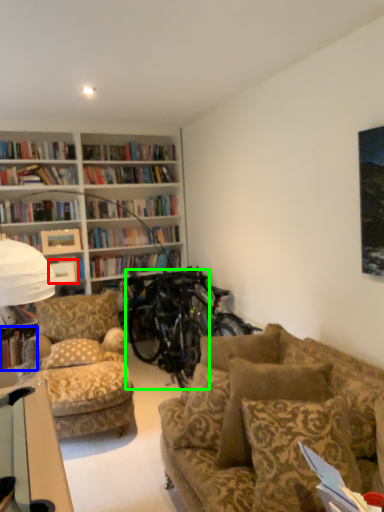
Question: Based on their relative distances, which object is nearer to picture frame (highlighted by a red box)? Choose from book (highlighted by a blue box) and bicycle (highlighted by a green box).

Choices:
 (A) book
 (B) bicycle

Answer: (A)